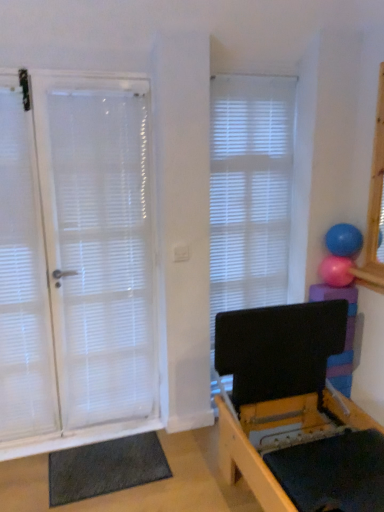
I want to click on vacant point above dark gray textured yoga mat at lower left (from a real-world perspective), so click(114, 459).